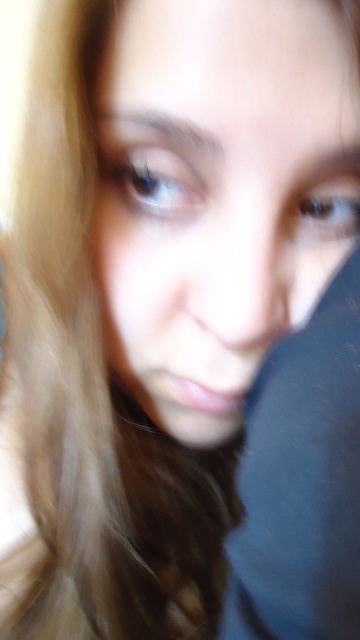
Is point (243, 8) farther from camera compared to point (333, 236)?

No, (243, 8) is closer to viewer.

Can you confirm if smooth skin face at center is positioned below blue glossy eye at upper right?

Correct, smooth skin face at center is located below blue glossy eye at upper right.

Does point (206, 397) lie in front of point (324, 184)?

That is False.

Where is `smooth skin face at center`? The height and width of the screenshot is (640, 360). smooth skin face at center is located at coordinates (214, 193).

Who is taller, smooth skin face at center or blue glossy eye at upper left?

With more height is smooth skin face at center.

Between smooth skin face at center and blue glossy eye at upper left, which one has less height?

blue glossy eye at upper left is shorter.

Does point (342, 237) lie behind point (136, 157)?

Yes, it is.

Locate an element on the screen. The height and width of the screenshot is (640, 360). smooth skin face at center is located at coordinates (214, 193).

Is point (177, 168) farther from viewer compared to point (342, 234)?

That is False.

Can you confirm if blue glossy eye at upper left is bigger than blue glossy eye at upper right?

Correct, blue glossy eye at upper left is larger in size than blue glossy eye at upper right.

Which is in front, point (150, 184) or point (316, 232)?

Point (150, 184) is more forward.

The image size is (360, 640). I want to click on blue glossy eye at upper left, so click(156, 182).